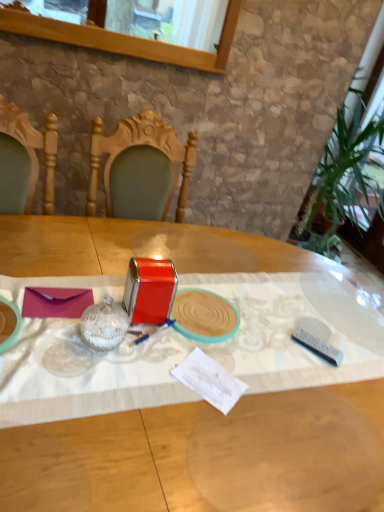
This screenshot has width=384, height=512. I want to click on vacant area that lies in front of metallic red tin at center, marked as the third tableware in a left-to-right arrangement, so click(x=180, y=362).